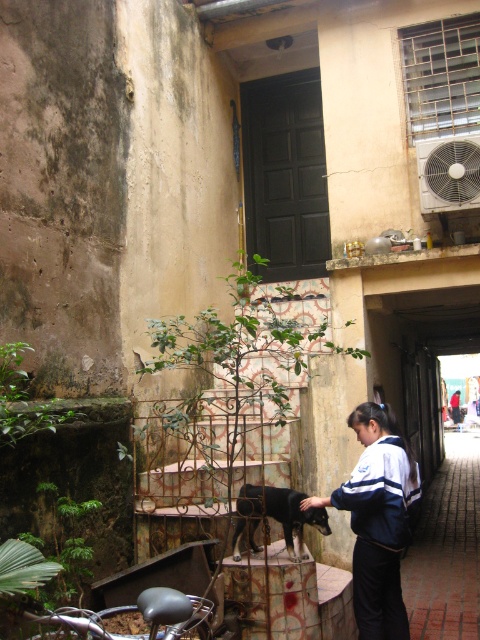
You are a delivery person trying to navigate through the alleyway. There is a white plastic air conditioner at upper right. Can you estimate its position relative to the center of the alleyway?

The white plastic air conditioner at upper right is located at point 0.270 on the x axis and 0.935 on the y axis, which is to the left and slightly below the center of the alleyway.